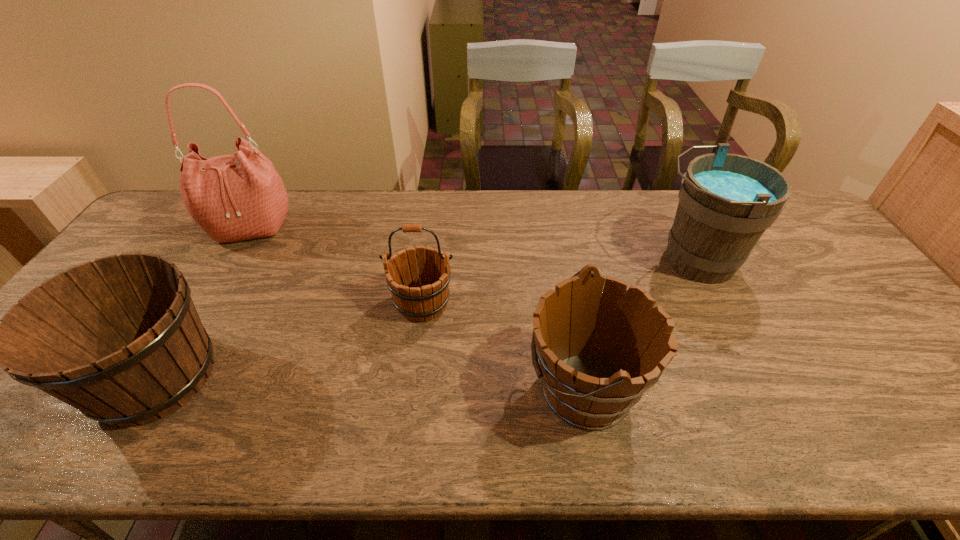
At what (x,y) coordinates should I click in order to perform the action: click on vacant space at the left edge. Please return your answer as a coordinate pair (x, y). This screenshot has width=960, height=540. Looking at the image, I should click on (156, 247).

Locate an element on the screen. The image size is (960, 540). free space between the third wine bucket from right to left and the leftmost wine bucket is located at coordinates (289, 340).

The image size is (960, 540). I want to click on free space between the leftmost wine bucket and the rightmost wine bucket, so click(425, 319).

This screenshot has height=540, width=960. What are the coordinates of `free space between the handbag and the rightmost wine bucket` in the screenshot? It's located at (472, 244).

Find the location of a particular element. This screenshot has height=540, width=960. free area in between the third object from right to left and the rightmost object is located at coordinates (558, 282).

Identify the location of unoccupied position between the rightmost object and the third object from left to right. This screenshot has width=960, height=540. (558, 282).

You are a GUI agent. You are given a task and a screenshot of the screen. Output one action in this format:
    pyautogui.click(x=<x>, y=<y>)
    Task: Click on the vacant area that lies between the leftmost wine bucket and the second object from right to left
    The width and height of the screenshot is (960, 540).
    Given the screenshot: What is the action you would take?
    pyautogui.click(x=370, y=382)

This screenshot has width=960, height=540. I want to click on blank region between the rightmost wine bucket and the third wine bucket from right to left, so click(x=558, y=282).

Locate an element on the screen. the second closest object to the leftmost wine bucket is located at coordinates (415, 298).

The width and height of the screenshot is (960, 540). I want to click on object that is the fourth closest one to the second wine bucket from left to right, so click(x=726, y=201).